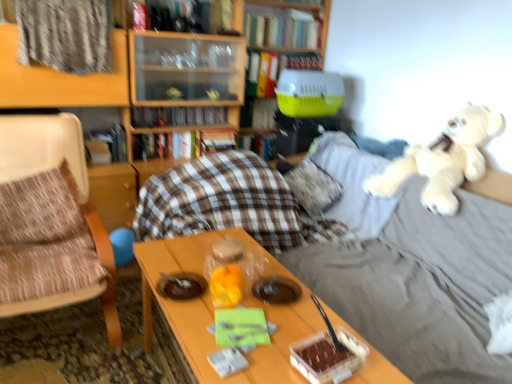
Question: Considering the relative sizes of hardcover book at upper center, the eighth book from the bottom, and metallic silver book at upper center, positioned as the seventh book in bottom-to-top order, in the image provided, is hardcover book at upper center, the eighth book from the bottom, wider than metallic silver book at upper center, positioned as the seventh book in bottom-to-top order,?

Choices:
 (A) no
 (B) yes

Answer: (A)

Question: Is hardcover book at upper center, acting as the 1th book starting from the top, looking in the opposite direction of metallic silver book at upper center, positioned as the seventh book in bottom-to-top order?

Choices:
 (A) no
 (B) yes

Answer: (A)

Question: Is hardcover book at upper center, the eighth book from the bottom, oriented towards metallic silver book at upper center, the 2th book positioned from the top?

Choices:
 (A) yes
 (B) no

Answer: (B)

Question: Is hardcover book at upper center, acting as the 1th book starting from the top, thinner than metallic silver book at upper center, the 2th book positioned from the top?

Choices:
 (A) yes
 (B) no

Answer: (A)

Question: Considering the relative sizes of hardcover book at upper center, acting as the 1th book starting from the top, and metallic silver book at upper center, the 2th book positioned from the top, in the image provided, is hardcover book at upper center, acting as the 1th book starting from the top, shorter than metallic silver book at upper center, the 2th book positioned from the top,?

Choices:
 (A) no
 (B) yes

Answer: (A)

Question: Do you think hardcover book at center, which is the seventh book in top-to-bottom order, is within wooden bookcase at upper center, or outside of it?

Choices:
 (A) inside
 (B) outside

Answer: (B)

Question: Visually, is hardcover book at center, which is the 2th book from bottom to top, positioned to the left or to the right of wooden bookcase at upper center?

Choices:
 (A) left
 (B) right

Answer: (B)

Question: Is hardcover book at center, which is the seventh book in top-to-bottom order, bigger or smaller than wooden bookcase at upper center?

Choices:
 (A) big
 (B) small

Answer: (B)

Question: In terms of height, does hardcover book at center, which is the 2th book from bottom to top, look taller or shorter compared to wooden bookcase at upper center?

Choices:
 (A) short
 (B) tall

Answer: (A)

Question: Is hardcover book at center, which is the 2th book from bottom to top, inside the boundaries of white plush at upper right, or outside?

Choices:
 (A) outside
 (B) inside

Answer: (A)

Question: From the image's perspective, is hardcover book at center, which is the 2th book from bottom to top, located above or below white plush at upper right?

Choices:
 (A) below
 (B) above

Answer: (B)

Question: Visually, is hardcover book at center, which is the seventh book in top-to-bottom order, positioned to the left or to the right of white plush at upper right?

Choices:
 (A) right
 (B) left

Answer: (B)

Question: From a real-world perspective, is hardcover book at center, which is the seventh book in top-to-bottom order, positioned above or below white plush at upper right?

Choices:
 (A) above
 (B) below

Answer: (B)

Question: Considering their positions, is plaid fabric at upper left located in front of or behind hardcover book at center, the third book positioned from the top?

Choices:
 (A) front
 (B) behind

Answer: (A)

Question: Considering the positions of plaid fabric at upper left and hardcover book at center, the third book positioned from the top, in the image, is plaid fabric at upper left taller or shorter than hardcover book at center, the third book positioned from the top,?

Choices:
 (A) tall
 (B) short

Answer: (A)